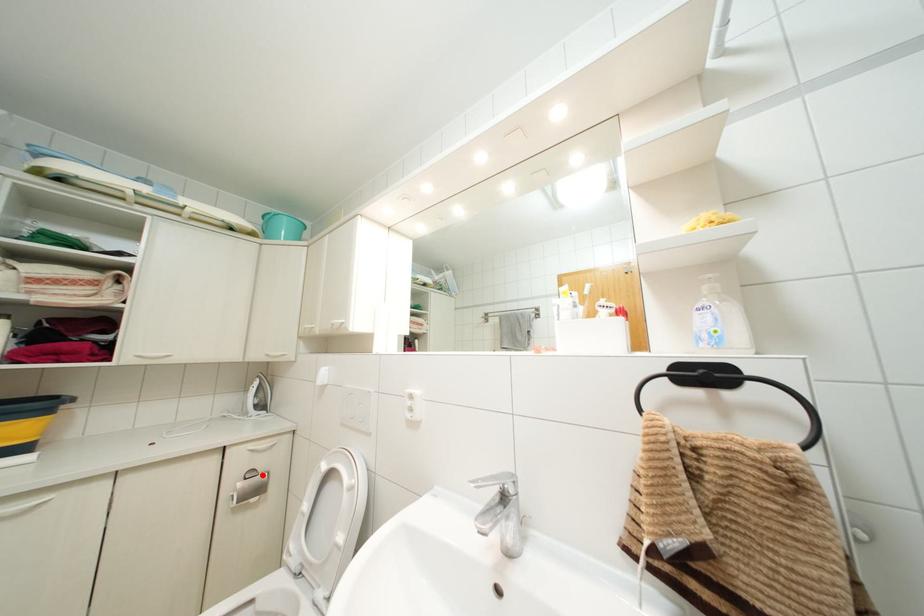
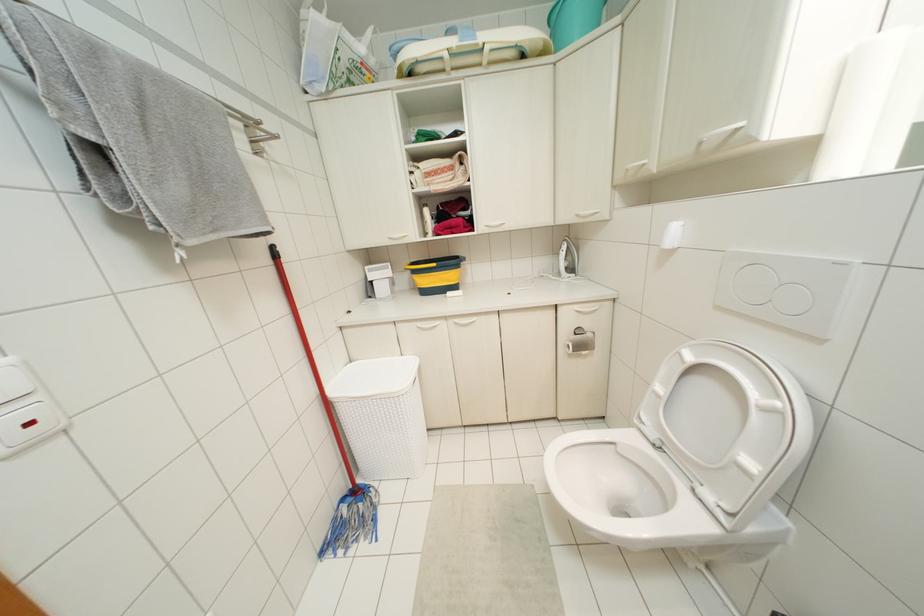
Locate, in the second image, the point that corresponds to the highlighted location in the first image.

(589, 334)